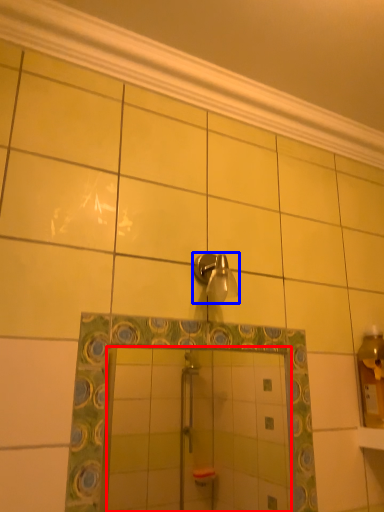
Question: Which point is further to the camera, mirror (highlighted by a red box) or shower (highlighted by a blue box)?

Choices:
 (A) mirror
 (B) shower

Answer: (B)